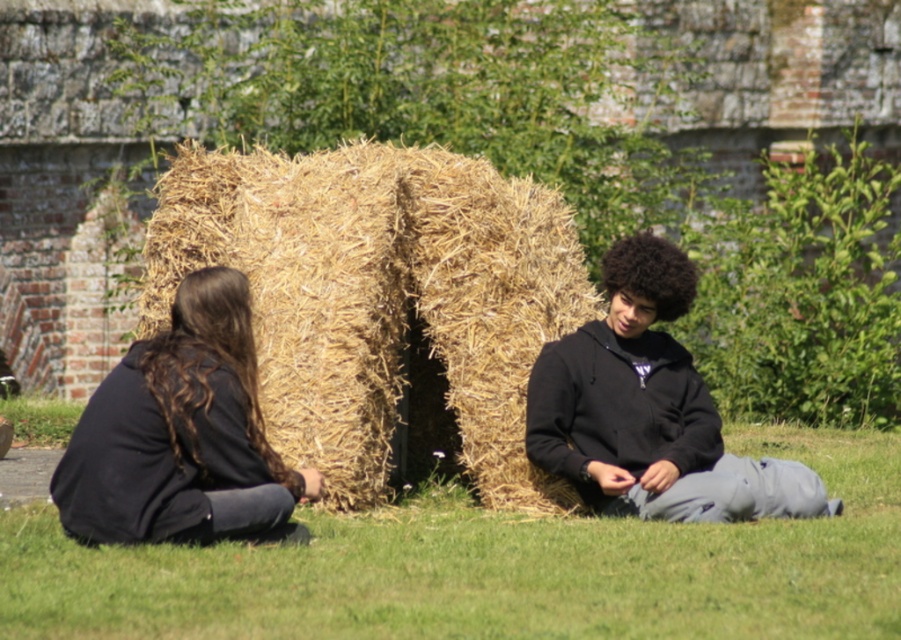
You are planning to place a small picnic basket on the ground between the green grass at lower center and the black matte hoodie at center. Based on their widths, which object can accommodate the basket more comfortably?

The green grass at lower center has a greater width than the black matte hoodie at center, so placing the picnic basket on the green grass at lower center would be more comfortable as it offers more space.

You are planning to place a new bench in the garden. The golden straw bale at center and the black matte hoodie at center are in the way. Which object should you move first to make space for the bench?

The golden straw bale at center is larger than the black matte hoodie at center, so you should move the golden straw bale at center first to make space for the bench.

You are a photographer trying to capture a portrait of the dark brown hair at left and the black matte hoodie at center. Since you want to focus on their faces, which object should you adjust your camera angle to look above of?

The dark brown hair at left is located below the black matte hoodie at center, so you should adjust your camera angle to look above the dark brown hair at left to focus on the faces.